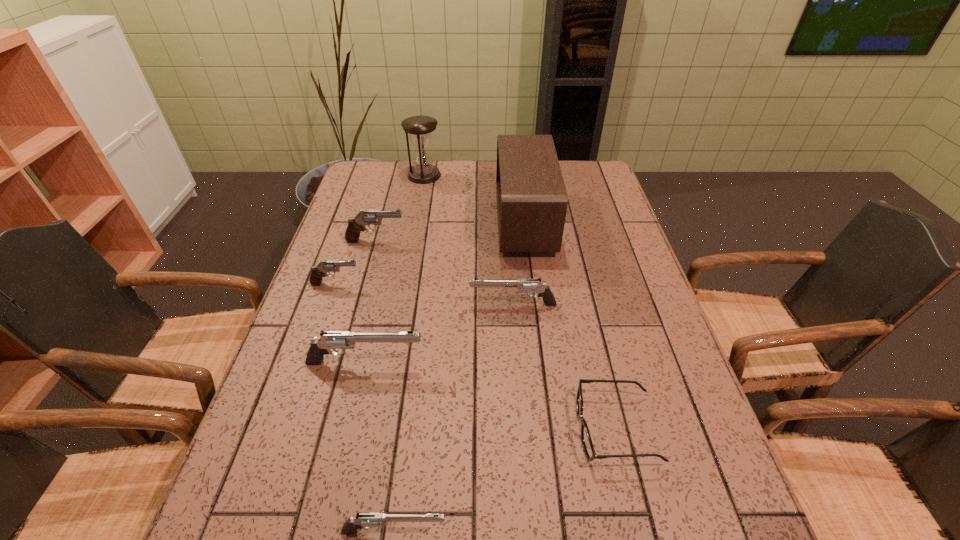
Locate an element on the screen. The image size is (960, 540). object that is at the near edge is located at coordinates (368, 519).

Image resolution: width=960 pixels, height=540 pixels. I want to click on object situated at the right edge, so click(x=590, y=453).

In the image, there is a desktop. Identify the location of vacant area at the far edge. (448, 191).

Identify the location of free space at the left edge. (313, 332).

Locate an element on the screen. The height and width of the screenshot is (540, 960). vacant space at the right edge of the desktop is located at coordinates (657, 310).

In the image, there is a desktop. Identify the location of vacant space at the far left corner. (370, 168).

Where is `vacant space at the far right corner of the desktop`? vacant space at the far right corner of the desktop is located at coordinates (578, 192).

This screenshot has height=540, width=960. What are the coordinates of `free point between the radio receiver and the second shortest object` in the screenshot? It's located at (459, 376).

Locate an element on the screen. free space between the third nearest object and the farthest object is located at coordinates (395, 269).

Locate an element on the screen. Image resolution: width=960 pixels, height=540 pixels. free space between the biggest silver pistol and the third nearest pistol is located at coordinates (440, 334).